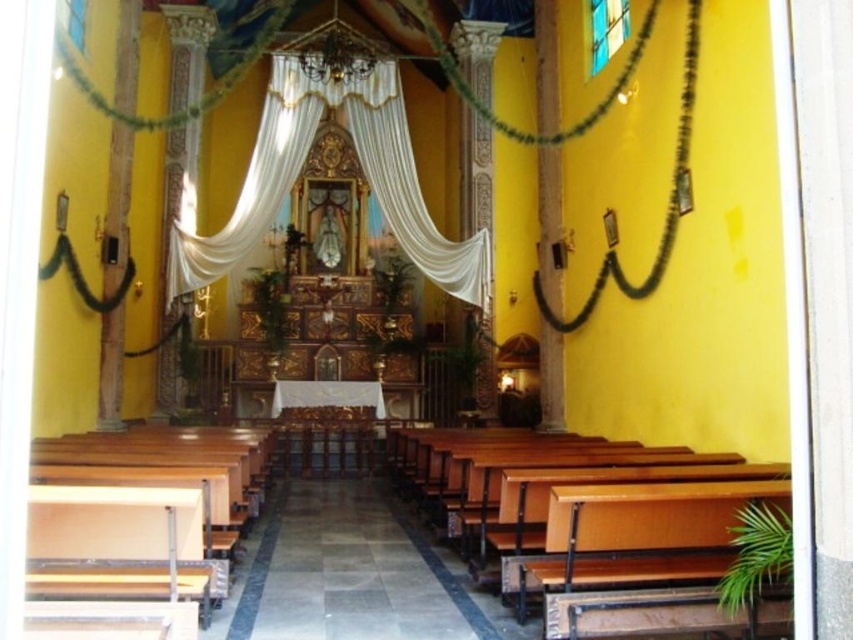
You are standing in the church and see the point labeled as point (604, 531). According to the scene description, where is this point located?

The point (604, 531) is located on the wooden church bench at center.

You are standing in the church and want to sit down. Where is the wooden church bench at center located?

The wooden church bench at center is located at point (604, 531).